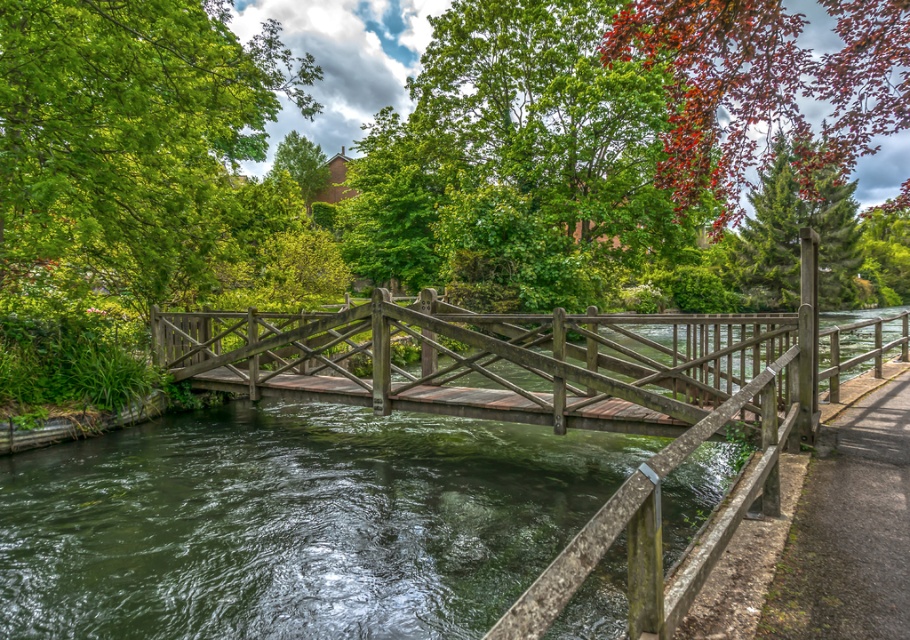
You are standing on the brown wooden path at lower right and want to cross to the green mossy water at center. Is the water directly in front of you or to your left?

Answer: The green mossy water at center is to the left of the brown wooden path at lower right, so the water is to your left when facing away from the path.

In the scene shown: You are standing at the point with coordinates point (254, 369) and want to walk to the point with coordinates point (905, 476). Is there a clear path between these two points without any obstacles?

The path between point (254, 369) and point (905, 476) is clear since there are no obstacles mentioned in the scene description.